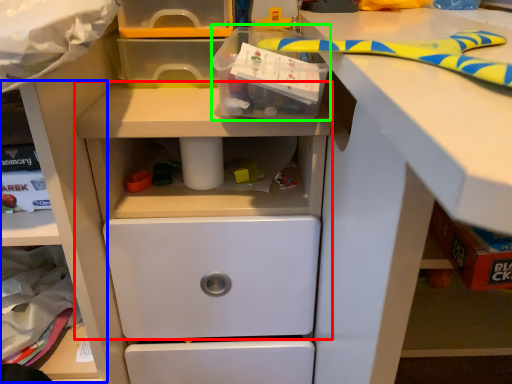
Question: Which object is positioned closest to workbench (highlighted by a red box)? Select from shelf (highlighted by a blue box) and box (highlighted by a green box).

Choices:
 (A) shelf
 (B) box

Answer: (A)